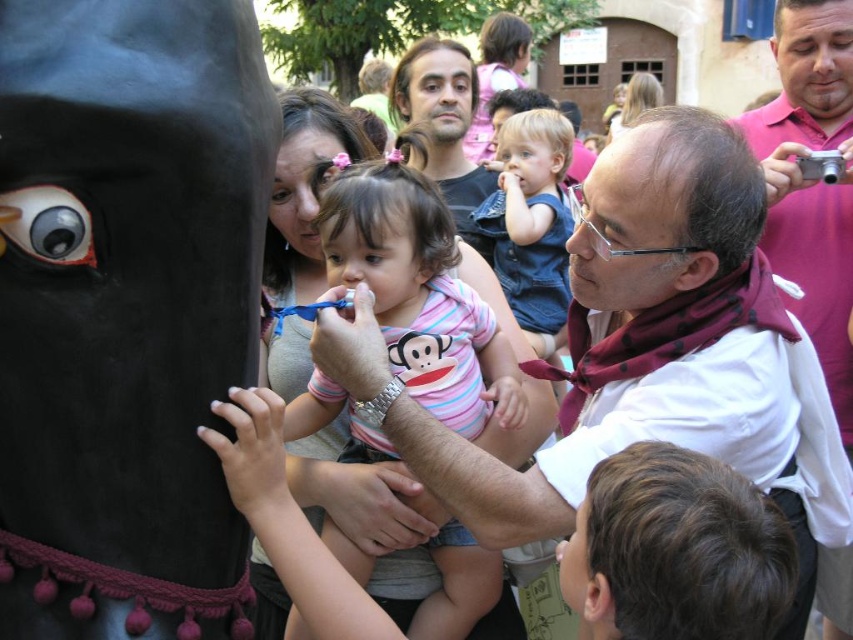
Looking at this image, you are standing at the point labeled as point (566, 163) and want to move towards the horse figure. Is the point labeled as point (459, 580) between you and the horse figure?

Yes, the point labeled as point (459, 580) is between you and the horse figure because it is in front of your current position at point (566, 163).

You are a photographer at the event and want to capture a photo of the striped cotton onesie at center and denim shirt at center. Which one should you focus on first if you want to ensure both are in focus?

The striped cotton onesie at center is located below denim shirt at center, so focusing on the denim shirt at center first would ensure both are in focus since it is closer to the camera.

You are a photographer at the event and want to capture a photo of the matte black shirt at center and the black velvet mask at left. Based on their positions, which one is closer to the camera?

The black velvet mask at left is positioned under the matte black shirt at center, so the matte black shirt at center is closer to the camera.